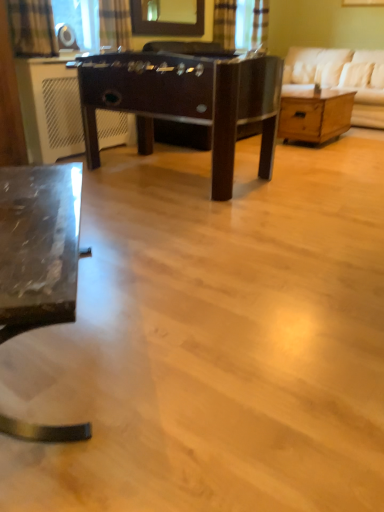
Question: Is plaid fabric curtain at upper center, the 1th curtain from the back, shorter than white fabric couch at upper right?

Choices:
 (A) yes
 (B) no

Answer: (A)

Question: Would you consider plaid fabric curtain at upper center, the 1th curtain from the back, to be distant from white fabric couch at upper right?

Choices:
 (A) no
 (B) yes

Answer: (B)

Question: Is plaid fabric curtain at upper center, positioned as the third curtain in left-to-right order, taller than white fabric couch at upper right?

Choices:
 (A) yes
 (B) no

Answer: (B)

Question: Would you say plaid fabric curtain at upper center, positioned as the third curtain in left-to-right order, contains white fabric couch at upper right?

Choices:
 (A) yes
 (B) no

Answer: (B)

Question: Does plaid fabric curtain at upper center, which ranks as the third curtain in front-to-back order, have a greater width compared to white fabric couch at upper right?

Choices:
 (A) no
 (B) yes

Answer: (A)

Question: Does plaid fabric curtain at upper center, which ranks as the third curtain in front-to-back order, have a larger size compared to white fabric couch at upper right?

Choices:
 (A) no
 (B) yes

Answer: (A)

Question: Can you see plaid fabric curtain at upper left, positioned as the 3th curtain in top-to-bottom order, touching plaid fabric curtain at upper center, the 2th curtain positioned from the top?

Choices:
 (A) no
 (B) yes

Answer: (A)

Question: Is plaid fabric curtain at upper left, which appears as the 1th curtain when viewed from the front, oriented towards plaid fabric curtain at upper center, positioned as the 2th curtain in bottom-to-top order?

Choices:
 (A) no
 (B) yes

Answer: (A)

Question: Is plaid fabric curtain at upper center, the 2th curtain positioned from the back, surrounded by plaid fabric curtain at upper left, which is counted as the 1th curtain, starting from the left?

Choices:
 (A) no
 (B) yes

Answer: (A)

Question: Is plaid fabric curtain at upper left, which is counted as the 1th curtain, starting from the left, to the right of plaid fabric curtain at upper center, the second curtain positioned from the right, from the viewer's perspective?

Choices:
 (A) yes
 (B) no

Answer: (B)

Question: From a real-world perspective, is plaid fabric curtain at upper left, which is counted as the 1th curtain, starting from the left, located beneath plaid fabric curtain at upper center, the second curtain positioned from the right?

Choices:
 (A) no
 (B) yes

Answer: (B)

Question: From the image's perspective, would you say plaid fabric curtain at upper left, the third curtain when ordered from right to left, is positioned over plaid fabric curtain at upper center, placed as the 2th curtain when sorted from front to back?

Choices:
 (A) no
 (B) yes

Answer: (A)

Question: Does plaid fabric curtain at upper center, the 2th curtain positioned from the back, appear on the right side of glossy glass mirror at upper center?

Choices:
 (A) no
 (B) yes

Answer: (A)